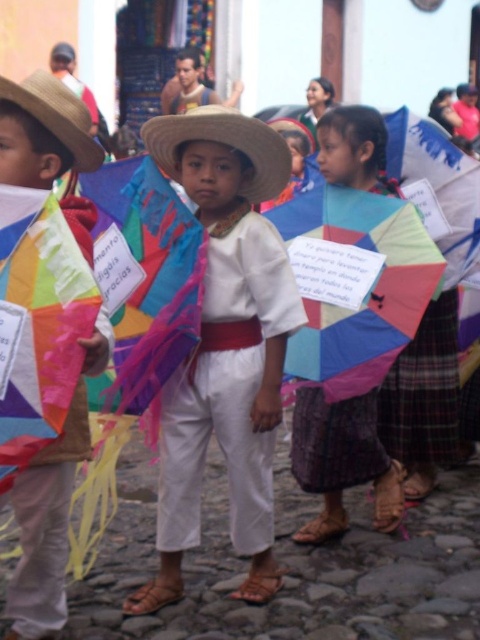
You are a photographer trying to capture the entire multicolored paper kite at center and the straw hat at center in one frame. Given that your camera has a fixed focal length, which object should you focus on first to ensure both are in the frame?

The multicolored paper kite at center is wider than the straw hat at center, so you should focus on the multicolored paper kite at center first to ensure both fit within the frame.